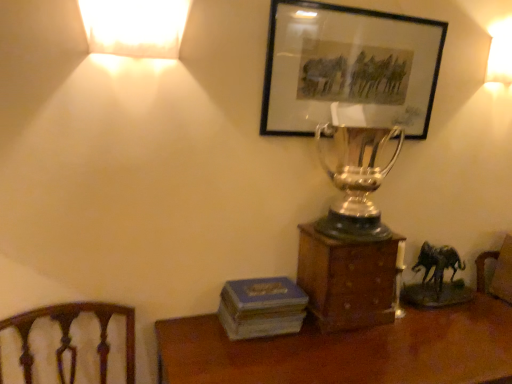
In order to click on vacant space in front of wooden box at center in this screenshot , I will do `click(362, 355)`.